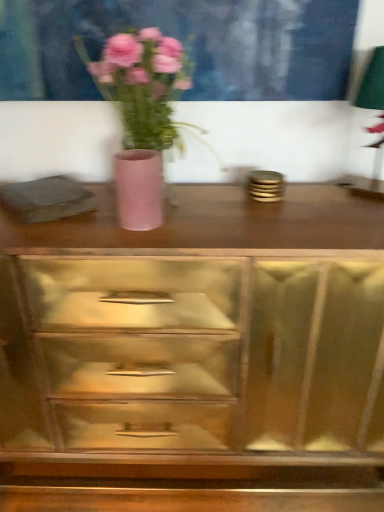
Locate an element on the screen. vacant area that is in front of pink matte vase at center is located at coordinates (148, 241).